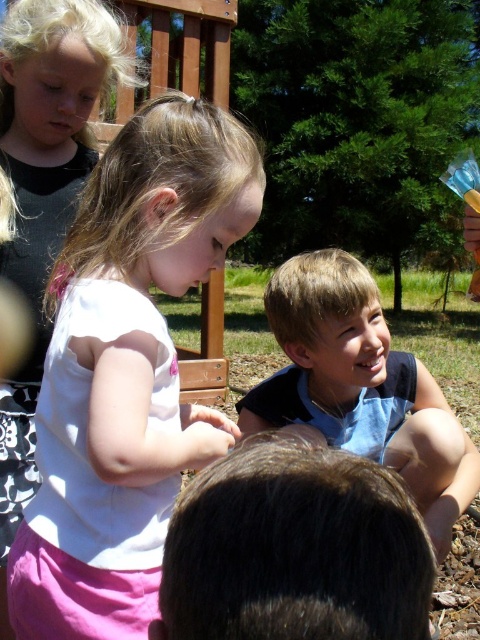
You are a photographer trying to capture the scene of the children playing in the park. You notice a point at coordinate (295,548). What object in the scene corresponds to this coordinate?

The point at coordinate (295,548) corresponds to the brown hair at lower center.

You are a photographer trying to capture the scene. The white matte shirt at center is located at point (129,365). If you want to focus on this point, which child should you adjust your camera to focus on?

The white matte shirt at center is located at point (129,365), so you should adjust your camera to focus on the child wearing the white matte shirt at center.